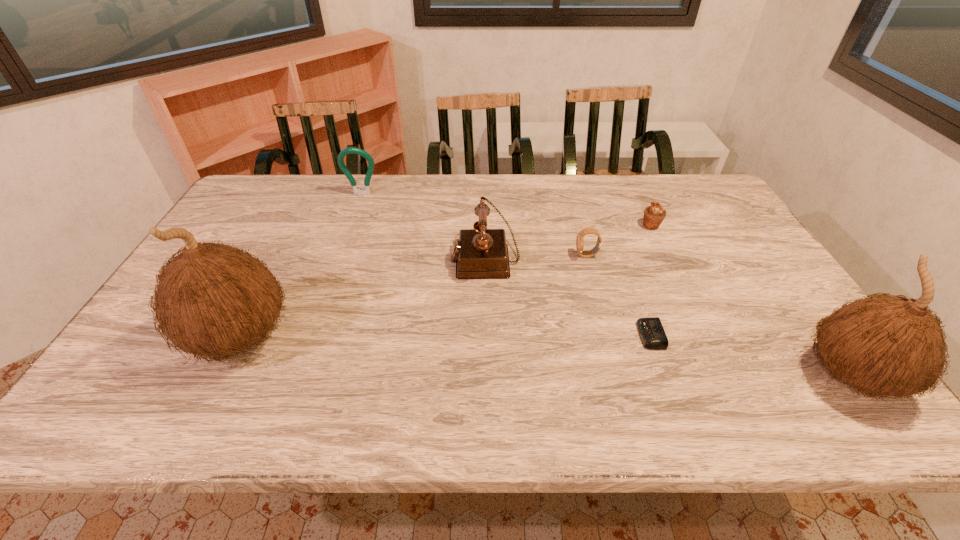
Find the location of a particular element. The image size is (960, 540). the taller coconut is located at coordinates point(212,299).

Image resolution: width=960 pixels, height=540 pixels. Identify the location of the tallest object. (212, 299).

This screenshot has height=540, width=960. I want to click on the right coconut, so click(x=887, y=345).

Find the location of `the shorter coconut`. the shorter coconut is located at coordinates (887, 345).

Find the location of a particular element. bottle opener is located at coordinates (366, 191).

The width and height of the screenshot is (960, 540). In order to click on the sixth nearest object in this screenshot , I will do `click(654, 214)`.

The width and height of the screenshot is (960, 540). I want to click on the second object from right to left, so click(x=654, y=214).

Locate an element on the screen. The image size is (960, 540). the fourth object from right to left is located at coordinates (580, 236).

Where is `telephone`? This screenshot has height=540, width=960. telephone is located at coordinates (480, 253).

Identify the location of alarm clock. Image resolution: width=960 pixels, height=540 pixels. (652, 334).